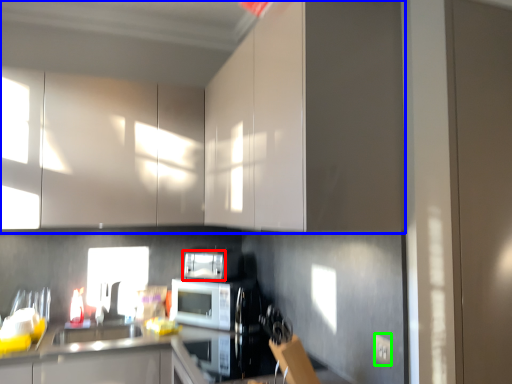
Question: Based on their relative distances, which object is farther from appliance (highlighted by a red box)? Choose from cabinetry (highlighted by a blue box) and electric outlet (highlighted by a green box).

Choices:
 (A) cabinetry
 (B) electric outlet

Answer: (B)